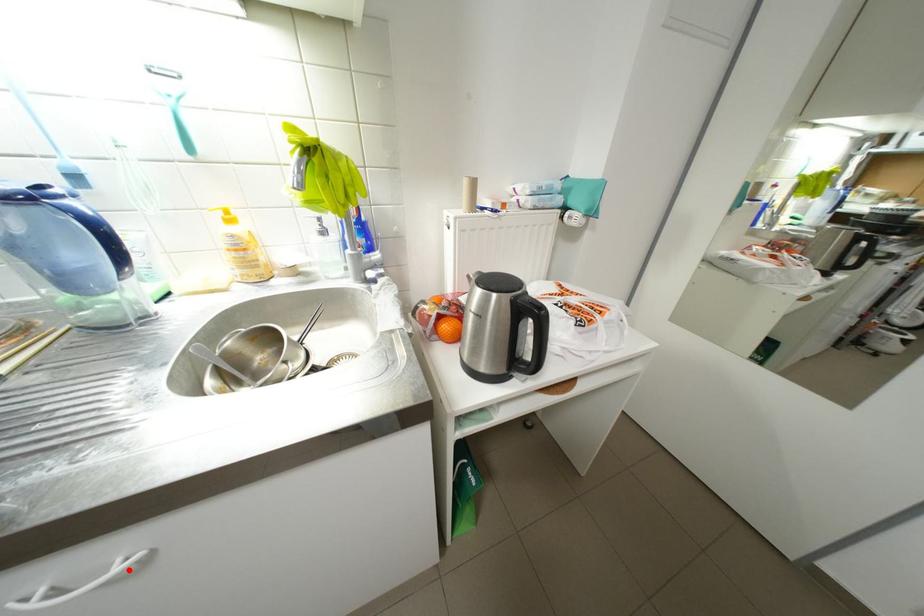
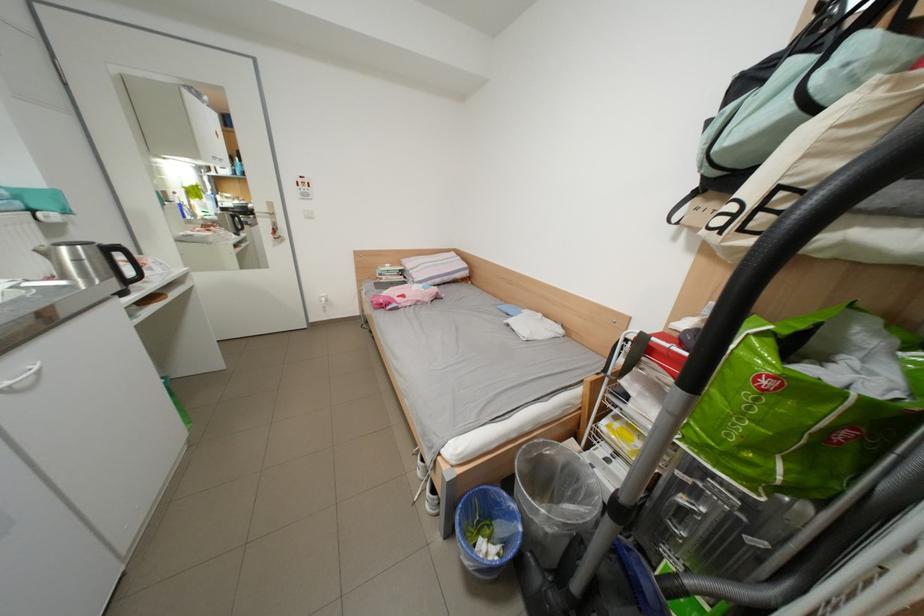
Question: I am providing you with two images of the same scene from different viewpoints. A red point is shown in image1. For the corresponding object point in image2, is it positioned nearer or farther from the camera?

Choices:
 (A) Nearer
 (B) Farther

Answer: (B)